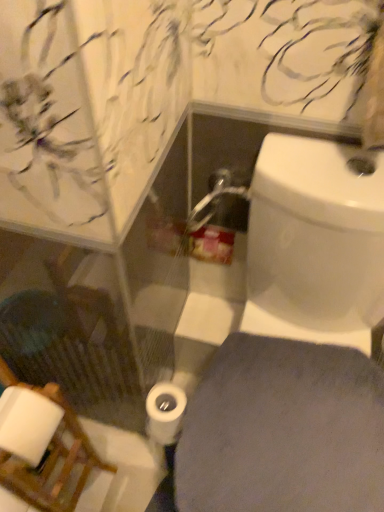
At what (x,y) coordinates should I click in order to perform the action: click on free spot above white glossy toilet at lower right (from a real-world perspective). Please return your answer as a coordinate pair (x, y). Looking at the image, I should click on (271, 432).